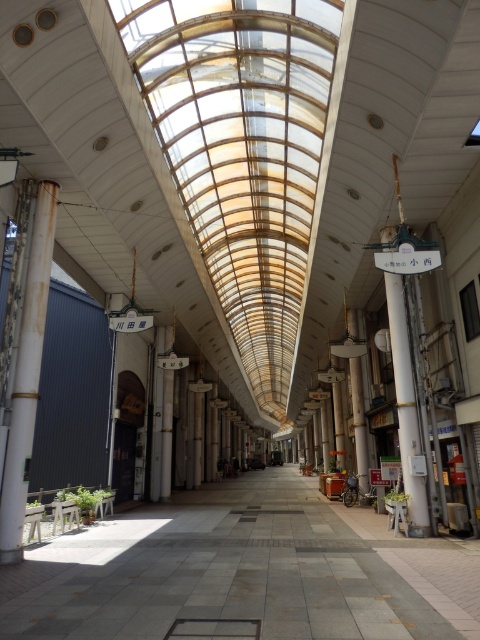
Between gray concrete corridor at center and rusty metal pole at left, which one has more height?

Standing taller between the two is rusty metal pole at left.

Between point (373, 564) and point (25, 284), which one is positioned in front?

Point (373, 564) is in front.

Which is behind, point (346, 609) or point (20, 493)?

The point (20, 493) is more distant.

Locate an element on the screen. The height and width of the screenshot is (640, 480). gray concrete corridor at center is located at coordinates (243, 570).